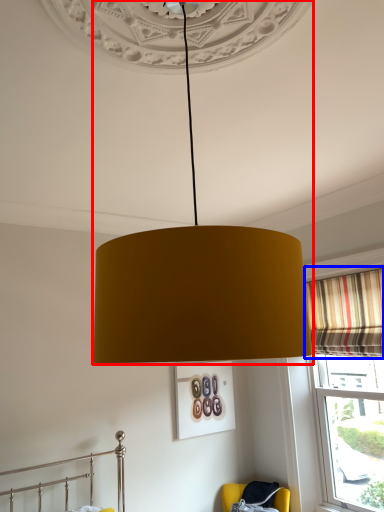
Question: Which point is closer to the camera, lamp (highlighted by a red box) or curtain (highlighted by a blue box)?

Choices:
 (A) lamp
 (B) curtain

Answer: (A)